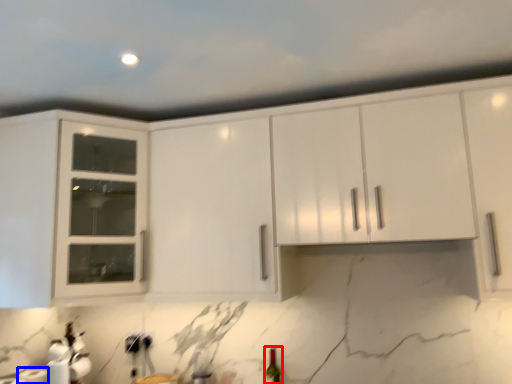
Question: Which of the following is the farthest to the observer, wine bottle (highlighted by a red box) or paper towel (highlighted by a blue box)?

Choices:
 (A) wine bottle
 (B) paper towel

Answer: (A)